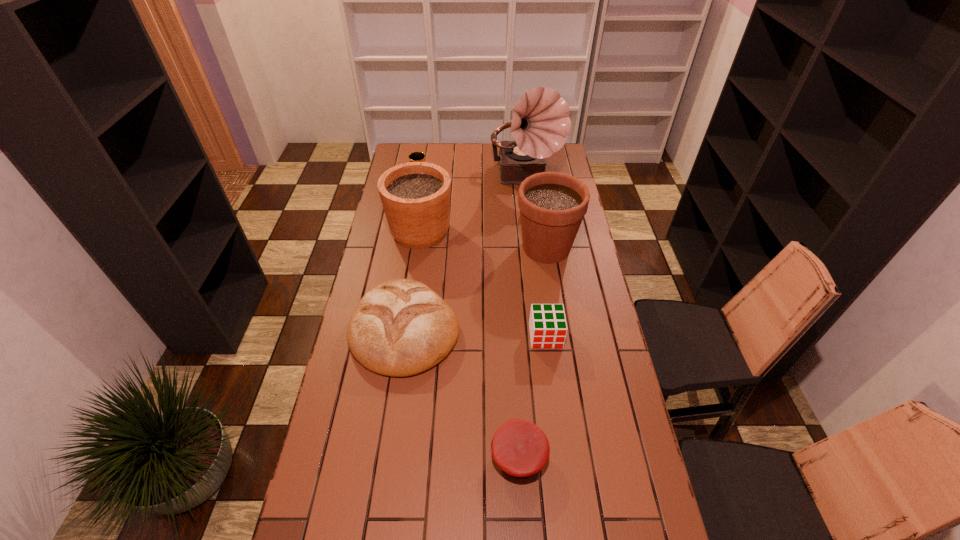
I want to click on record player, so click(x=540, y=123).

Identify the location of the right flowerpot. (552, 205).

Where is `the left flowerpot`? the left flowerpot is located at coordinates click(x=415, y=196).

This screenshot has height=540, width=960. Identify the location of chalice. (415, 156).

I want to click on bread, so click(401, 327).

The image size is (960, 540). I want to click on cube, so click(x=547, y=323).

Find the location of a particular element. The width and height of the screenshot is (960, 540). the nearest object is located at coordinates (520, 448).

The width and height of the screenshot is (960, 540). I want to click on the shortest object, so click(x=520, y=448).

This screenshot has width=960, height=540. I want to click on free space located from the horn of the tallest object, so click(x=536, y=254).

Identify the location of vacant space located 0.060m on the front of the right flowerpot. Image resolution: width=960 pixels, height=540 pixels. (551, 281).